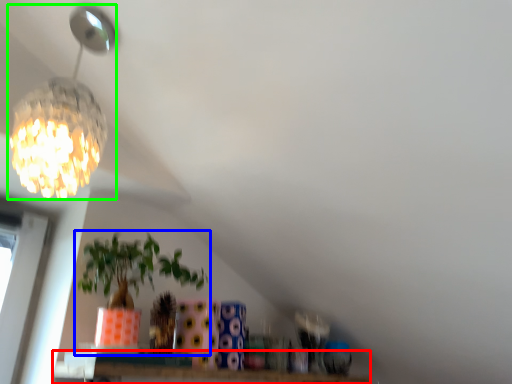
Question: Based on their relative distances, which object is farther from window (highlighted by a red box)? Choose from houseplant (highlighted by a blue box) and lamp (highlighted by a green box).

Choices:
 (A) houseplant
 (B) lamp

Answer: (B)